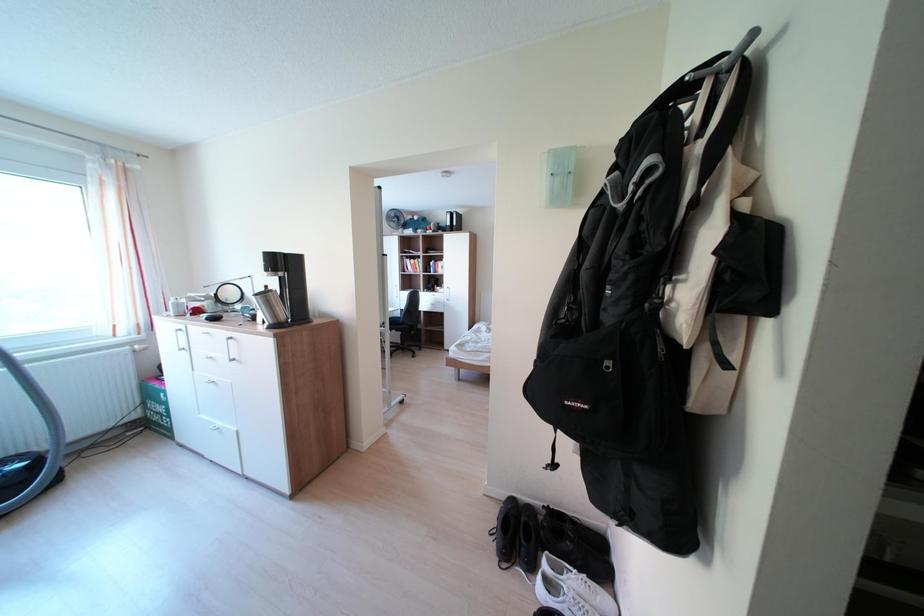
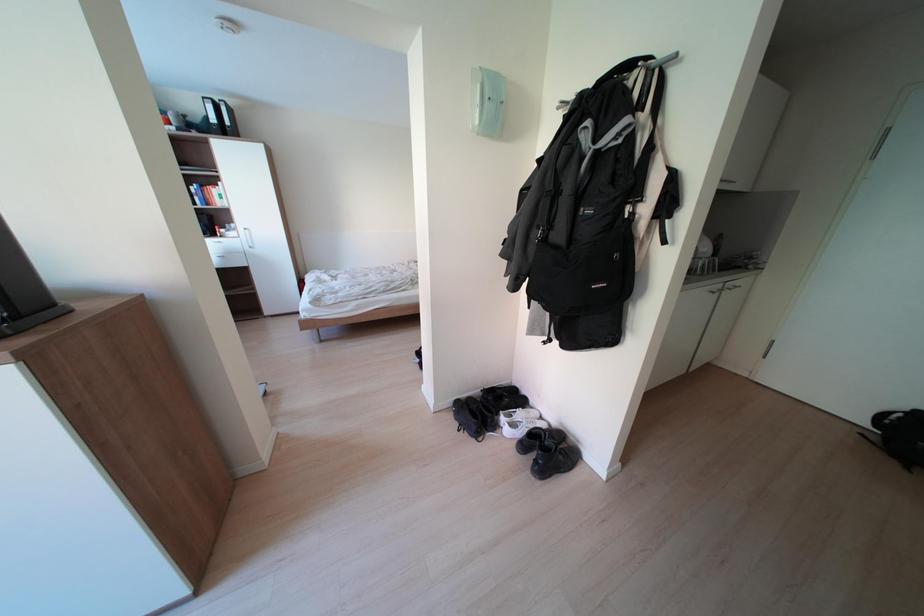
First-person continuous shooting, in which direction is the camera rotating?

The camera's rotation is toward right-down.